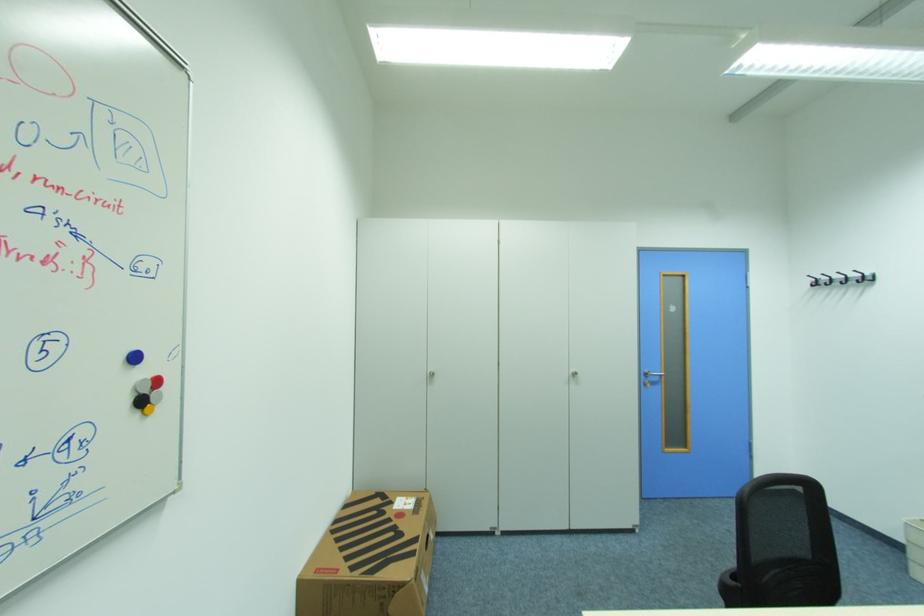
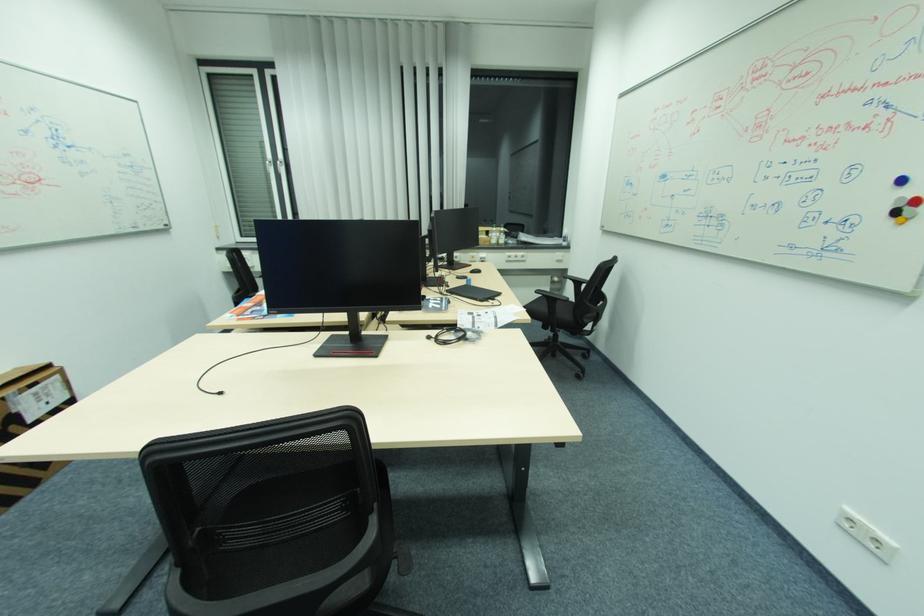
In the second image, find the point that corresponds to point 140,359 in the first image.

(908, 180)